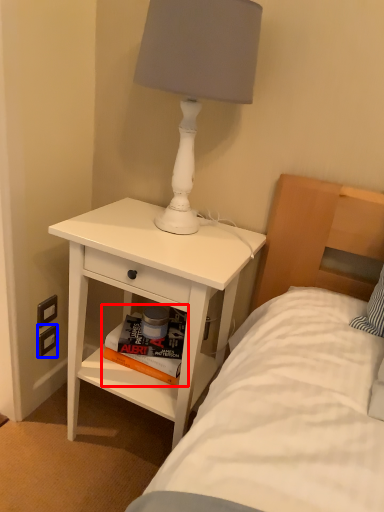
Question: Which object is closer to the camera taking this photo, magazine (highlighted by a red box) or electric outlet (highlighted by a blue box)?

Choices:
 (A) magazine
 (B) electric outlet

Answer: (A)